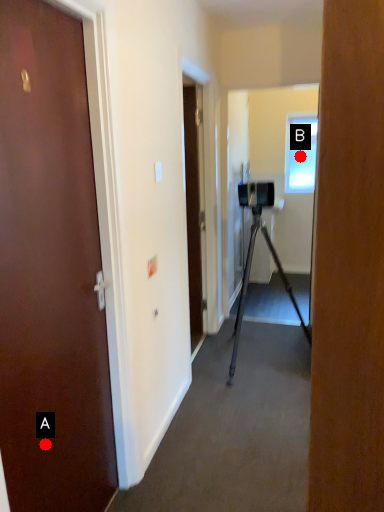
Question: Two points are circled on the image, labeled by A and B beside each circle. Which point appears farthest from the camera in this image?

Choices:
 (A) A is further
 (B) B is further

Answer: (B)